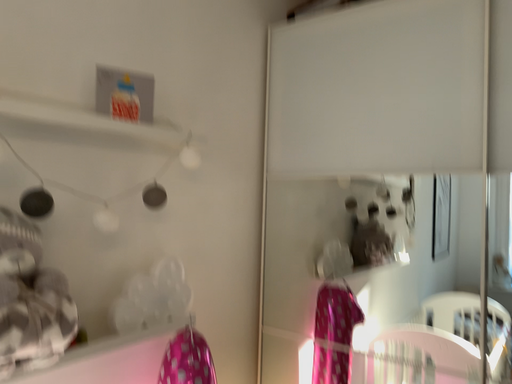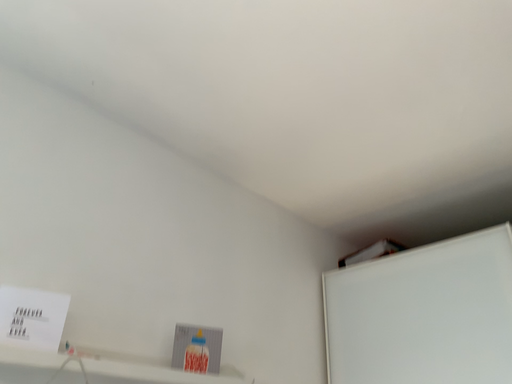
Question: Which way did the camera rotate in the video?

Choices:
 (A) rotated downward
 (B) rotated upward

Answer: (B)